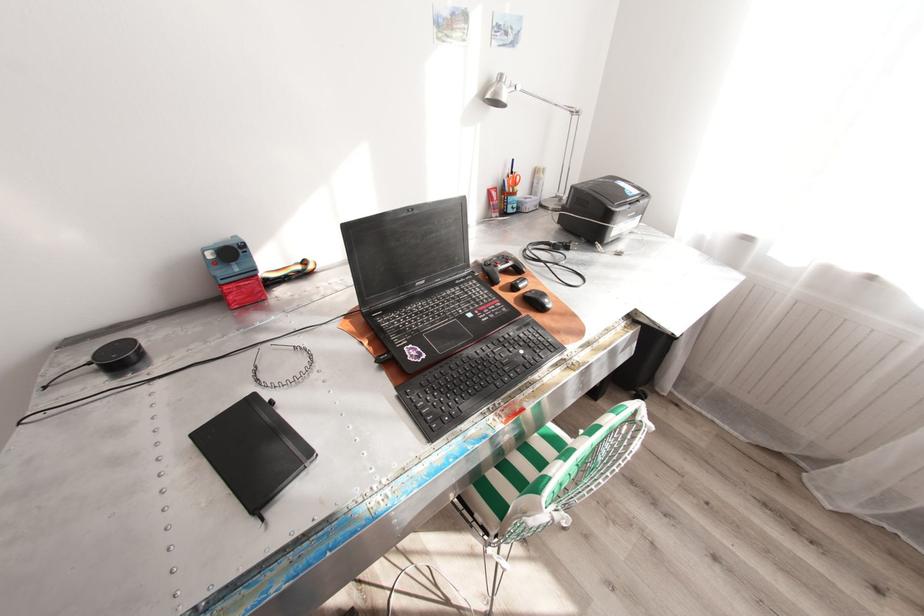
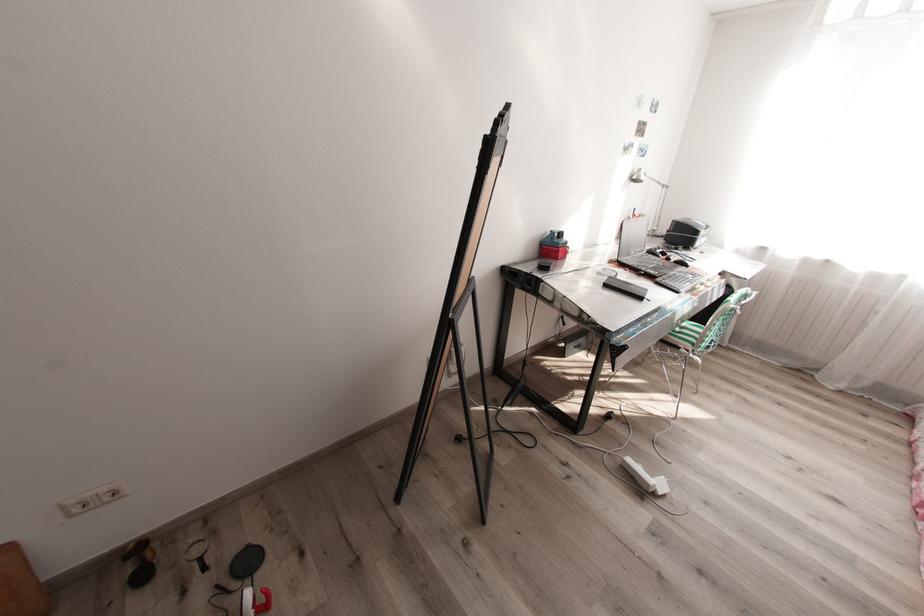
In a continuous first-person perspective shot, in which direction is the camera moving?

The cameraman walked toward left, backward.